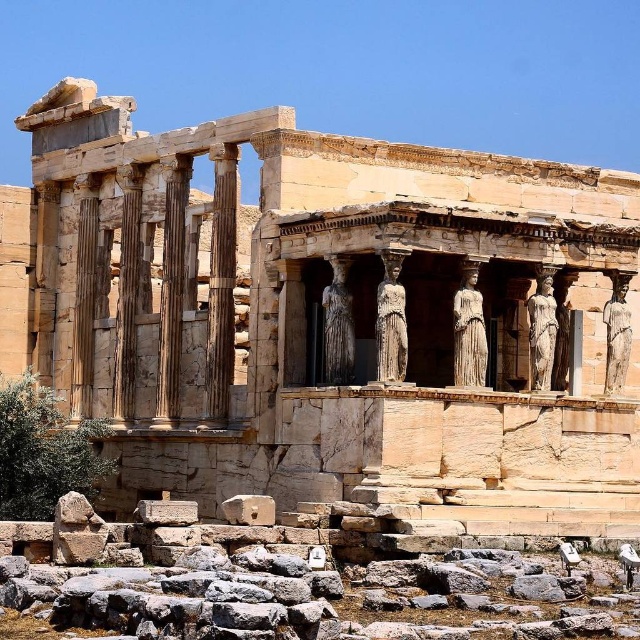
You are standing at the point marked as point (323, 316). Which object is exactly at your current position?

The beige stone temple at center is exactly at point (323, 316).